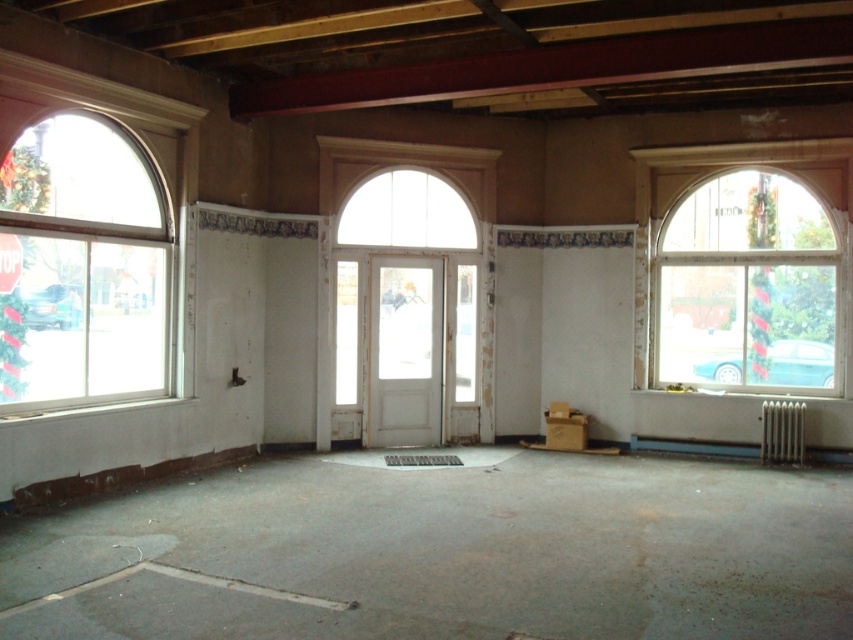
Between white glass window at left and clear glass window at right, which one appears on the left side from the viewer's perspective?

white glass window at left

Is white glass window at left further to camera compared to clear glass window at right?

No, it is in front of clear glass window at right.

Does point (47, 305) come farther from viewer compared to point (712, 237)?

No, (47, 305) is closer to viewer.

Where is `white glass window at left`? The width and height of the screenshot is (853, 640). white glass window at left is located at coordinates (80, 266).